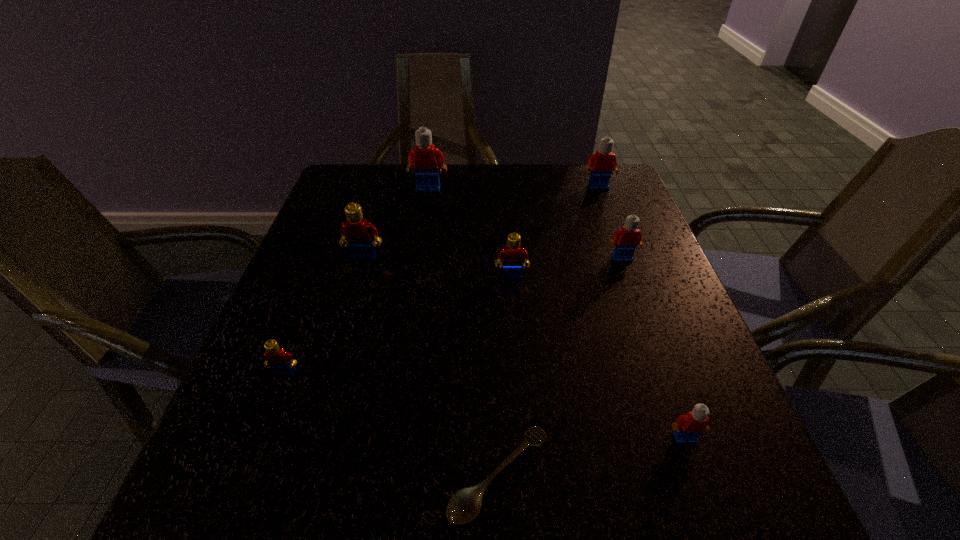
Locate an element on the screen. free spot located on the back of the shortest object is located at coordinates (493, 309).

Find the location of a particular element. object that is at the near edge is located at coordinates (465, 504).

I want to click on object present at the far right corner, so click(x=603, y=163).

This screenshot has height=540, width=960. What are the coordinates of `free space at the far edge of the desktop` in the screenshot? It's located at (540, 182).

The image size is (960, 540). In order to click on free space at the near edge of the desktop in this screenshot , I will do `click(351, 512)`.

Identify the location of vacant region at the left edge of the desktop. 342,310.

You are a GUI agent. You are given a task and a screenshot of the screen. Output one action in this format:
    pyautogui.click(x=<x>, y=<y>)
    Task: Click on the free space at the right edge
    
    Given the screenshot: What is the action you would take?
    coord(626,361)

Find the location of a particular element. free location at the far left corner is located at coordinates (371, 170).

This screenshot has width=960, height=540. In the image, there is a desktop. In order to click on vacant space at the near left corner in this screenshot , I will do click(x=234, y=496).

At what (x,y) coordinates should I click in order to perform the action: click on vacant area that lies between the second biggest white Lego and the second object from left to right. Please return your answer as a coordinate pair (x, y). The image size is (960, 540). Looking at the image, I should click on (481, 222).